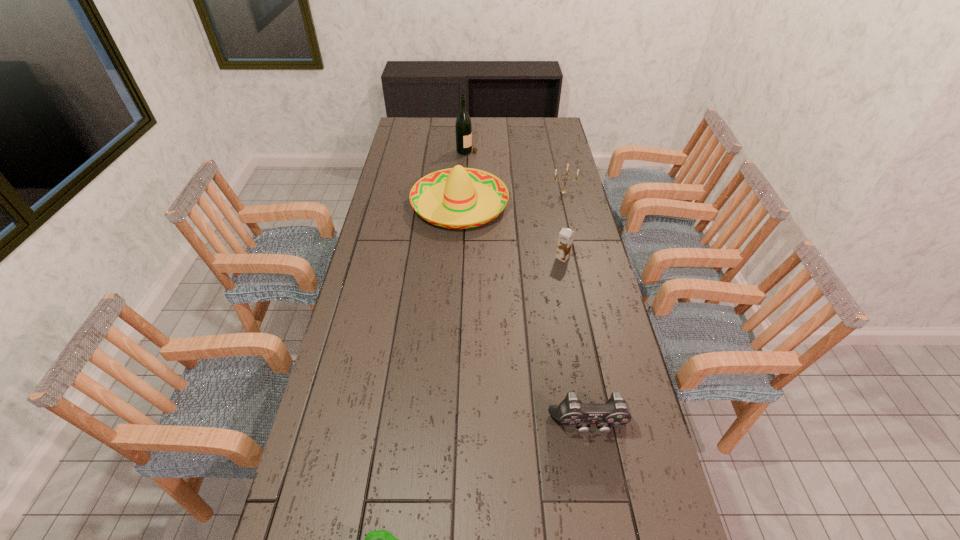
Identify the location of free space between the tallest object and the control. The height and width of the screenshot is (540, 960). (528, 288).

At what (x,y) coordinates should I click in order to perform the action: click on vacant point located between the fifth shortest object and the candle. Please return your answer as a coordinate pair (x, y). This screenshot has height=540, width=960. Looking at the image, I should click on (512, 198).

You are a GUI agent. You are given a task and a screenshot of the screen. Output one action in this format:
    pyautogui.click(x=<x>, y=<y>)
    Task: Click on the free space between the third nearest object and the second tallest object
    The image size is (960, 540).
    Given the screenshot: What is the action you would take?
    pyautogui.click(x=512, y=231)

I want to click on vacant area that lies between the control and the fourth farthest object, so click(x=576, y=341).

The height and width of the screenshot is (540, 960). I want to click on empty space that is in between the fifth farthest object and the sombrero, so click(524, 315).

Locate an element on the screen. The height and width of the screenshot is (540, 960). vacant space that's between the sombrero and the chocolate milk is located at coordinates (512, 231).

In order to click on blank region between the chocolate milk and the tallest object in this screenshot , I will do `click(515, 204)`.

Choose which object is the second nearest neighbor to the nearest object. Please provide its 2D coordinates. Your answer should be formatted as a tuple, i.e. [(x, y)], where the tuple contains the x and y coordinates of a point satisfying the conditions above.

[(565, 240)]

Identify which object is located as the fifth nearest to the control. Please provide its 2D coordinates. Your answer should be formatted as a tuple, i.e. [(x, y)], where the tuple contains the x and y coordinates of a point satisfying the conditions above.

[(463, 125)]